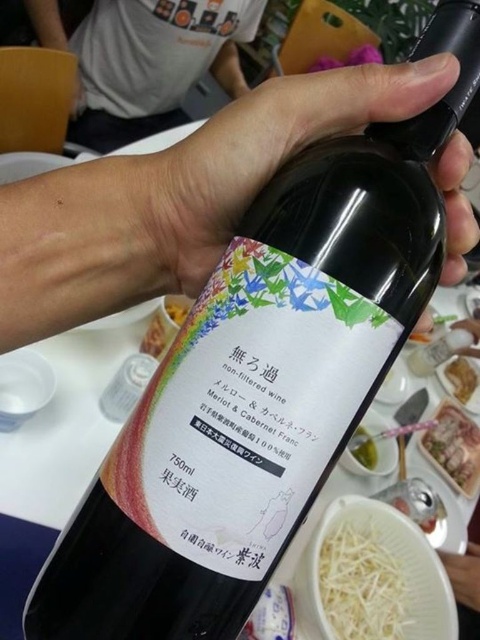
Which is more to the left, white stringy food at lower center or yellow crumbly cheese at bottle right?

Positioned to the left is yellow crumbly cheese at bottle right.

Does white stringy food at lower center have a lesser height compared to yellow crumbly cheese at bottle right?

In fact, white stringy food at lower center may be taller than yellow crumbly cheese at bottle right.

Between point (376, 554) and point (178, 301), which one is positioned behind?

The point (178, 301) is more distant.

This screenshot has width=480, height=640. I want to click on white stringy food at lower center, so click(x=360, y=584).

Who is positioned more to the right, matte black wine bottle at center or white stringy food at lower center?

white stringy food at lower center

Is point (212, 164) closer to viewer compared to point (325, 556)?

Yes, point (212, 164) is closer to viewer.

You are a GUI agent. You are given a task and a screenshot of the screen. Output one action in this format:
    pyautogui.click(x=<x>, y=<y>)
    Task: Click on the matte black wine bottle at center
    The width and height of the screenshot is (480, 640).
    Given the screenshot: What is the action you would take?
    pyautogui.click(x=268, y=150)

Between matte black wine bottle at center and translucent plastic container at lower right, which one has more height?

matte black wine bottle at center

Which is behind, point (205, 172) or point (452, 429)?

The point (452, 429) is more distant.

Locate an element on the screen. The height and width of the screenshot is (640, 480). matte black wine bottle at center is located at coordinates pyautogui.click(x=268, y=150).